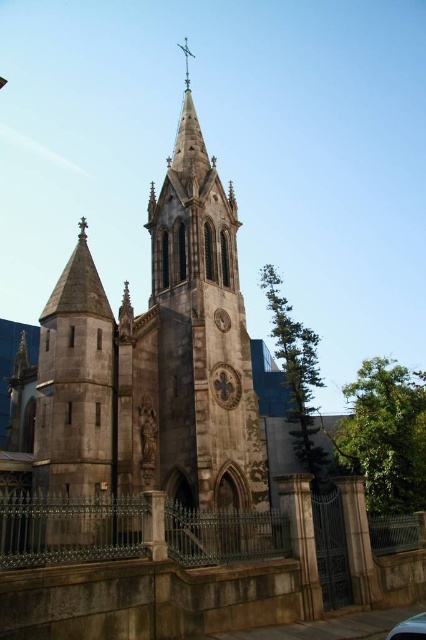
Looking at this image, you are standing in front of the Gothic church and want to take a photo that includes the stone steeple at center. Where should you position yourself relative to the steeple to ensure it is centered in your photo?

To center the stone steeple at center in your photo, position yourself directly in front of it, aligned with its coordinates at point (192, 362).

You are standing in front of the Gothic church and want to know how far you are from the point marked at coordinates point (183,449). Can you determine the distance?

The point marked at coordinates point (183,449) is 59.75 meters away from you.

You are standing in front of the Gothic church and want to take a photo that includes both the stone steeple at center and the metallic silver car at lower right. Which object should you focus on first to ensure both are in frame?

You should focus on the stone steeple at center first because it is taller than the metallic silver car at lower right, so you need to adjust your camera angle to include its full height while keeping the metallic silver car at lower right in the shot.